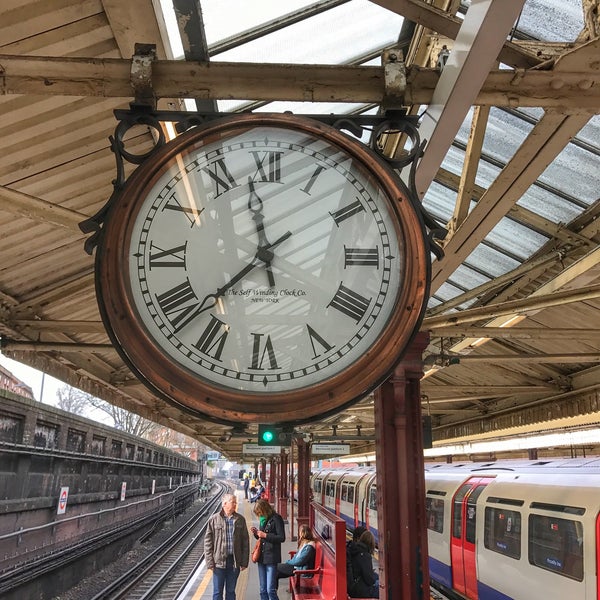
Image resolution: width=600 pixels, height=600 pixels. Find the location of `clock hands`. clock hands is located at coordinates (237, 277), (261, 225).